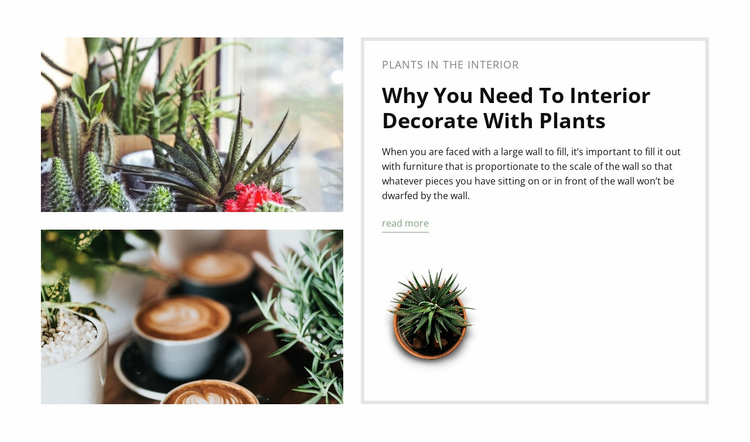
Locate an element on the screen. This screenshot has height=442, width=750. table is located at coordinates pos(271,354), pos(247,239).